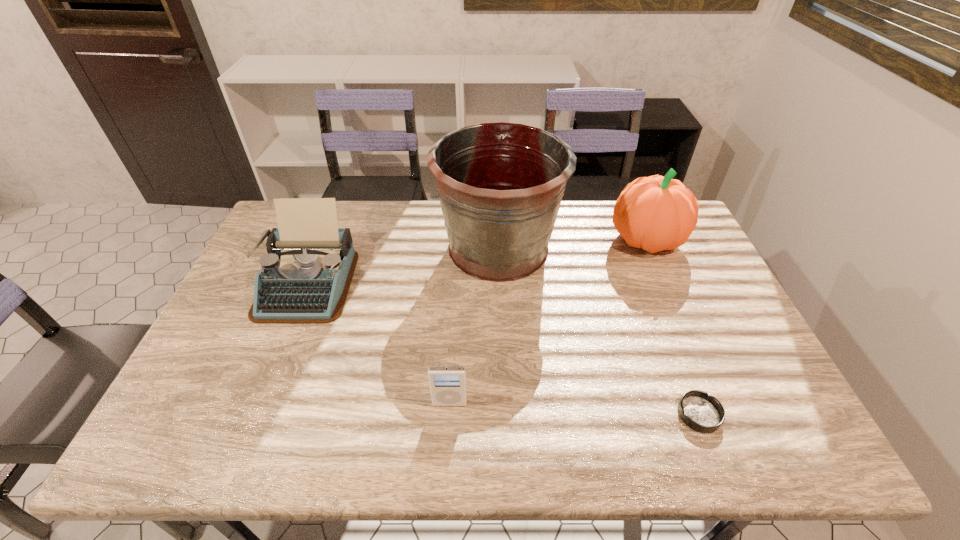
Locate an element on the screen. The image size is (960, 540). vacant space positioned on the left of the shortest object is located at coordinates (536, 414).

Find the location of a particular element. Image resolution: width=960 pixels, height=540 pixels. bucket located at the far edge is located at coordinates (500, 185).

Locate an element on the screen. This screenshot has height=540, width=960. pumpkin that is at the far edge is located at coordinates (655, 213).

At what (x,y) coordinates should I click in order to perform the action: click on object that is at the near edge. Please return your answer as a coordinate pair (x, y). The image size is (960, 540). Looking at the image, I should click on (703, 413).

Locate an element on the screen. object located at the left edge is located at coordinates (304, 279).

Find the location of a particular element. The image size is (960, 540). object located at the right edge is located at coordinates (655, 213).

The height and width of the screenshot is (540, 960). Find the location of `object located in the far right corner section of the desktop`. object located in the far right corner section of the desktop is located at coordinates (655, 213).

Locate an element on the screen. The image size is (960, 540). free spot at the far edge of the desktop is located at coordinates (340, 211).

Find the location of `vacant space at the near edge of the desktop`. vacant space at the near edge of the desktop is located at coordinates (707, 458).

I want to click on vacant area at the right edge of the desktop, so click(683, 286).